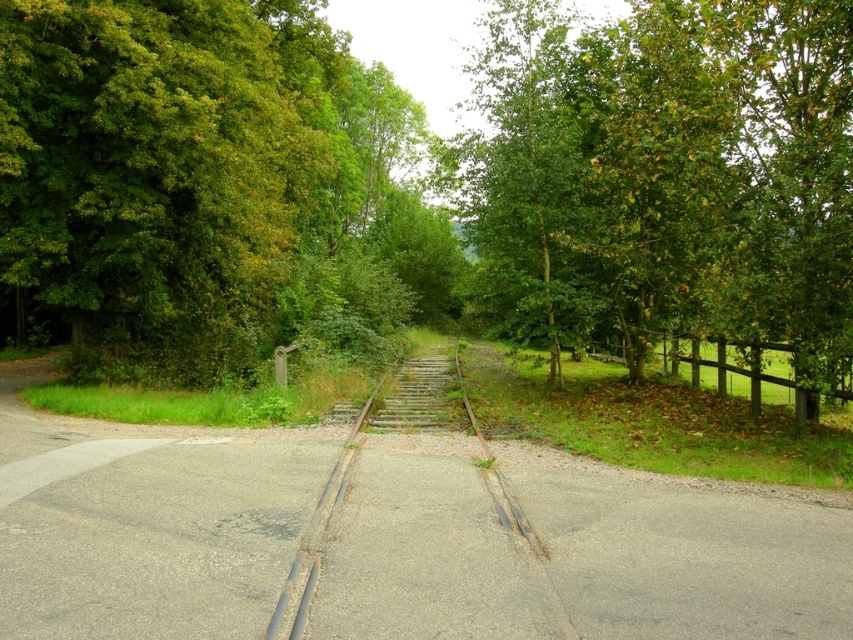
Question: Does rusty metal train track at center have a greater width compared to brown wooden fence at right?

Choices:
 (A) no
 (B) yes

Answer: (A)

Question: Which point is farther to the camera?

Choices:
 (A) (668, 296)
 (B) (447, 636)

Answer: (A)

Question: Which is nearer to the brown wooden fence at right?

Choices:
 (A) green leafy tree at center
 (B) rusty metal train track at center

Answer: (B)

Question: Which object is positioned farthest from the green leafy tree at center?

Choices:
 (A) brown wooden fence at right
 (B) rusty metal train track at center

Answer: (B)

Question: Observing the image, what is the correct spatial positioning of green leafy tree at upper right in reference to brown wooden fence at right?

Choices:
 (A) right
 (B) left

Answer: (B)

Question: Can you confirm if green leafy tree at upper right is positioned to the right of rusty metal train track at center?

Choices:
 (A) no
 (B) yes

Answer: (B)